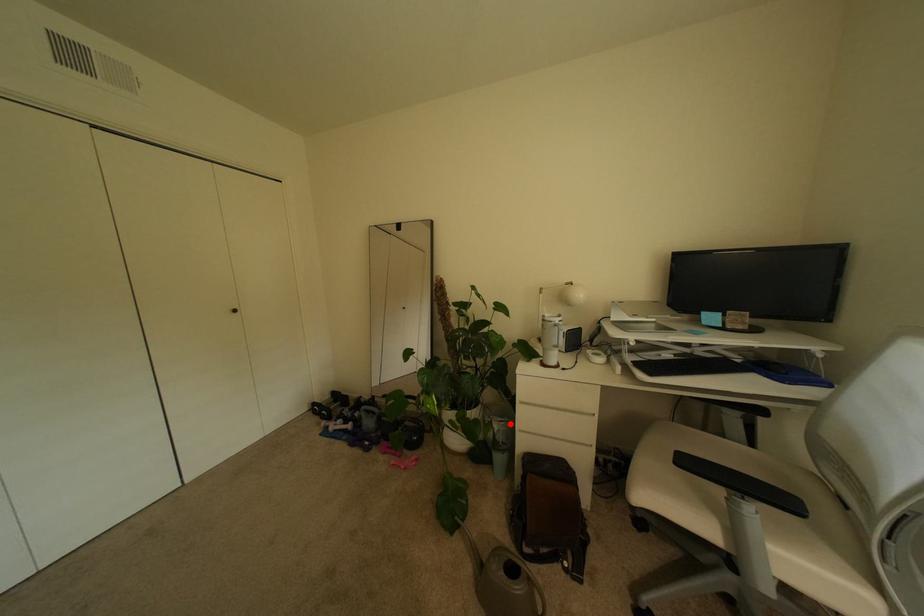
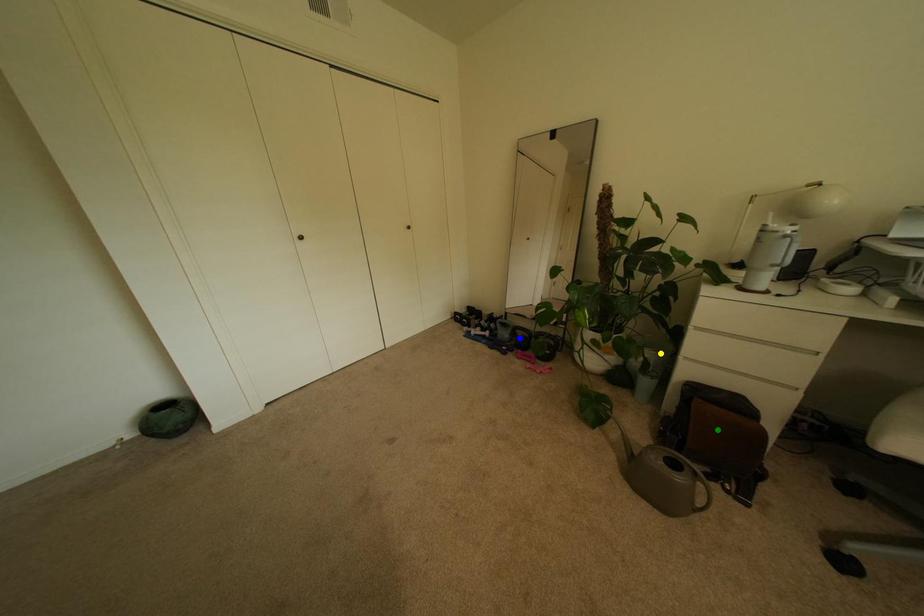
Question: I am providing you with two images of the same scene from different viewpoints. A red point is marked on the first image. You are given multiple points on the second image. Can you choose the point in image 2 that corresponds to the point in image 1?

Choices:
 (A) green point
 (B) yellow point
 (C) blue point

Answer: (B)